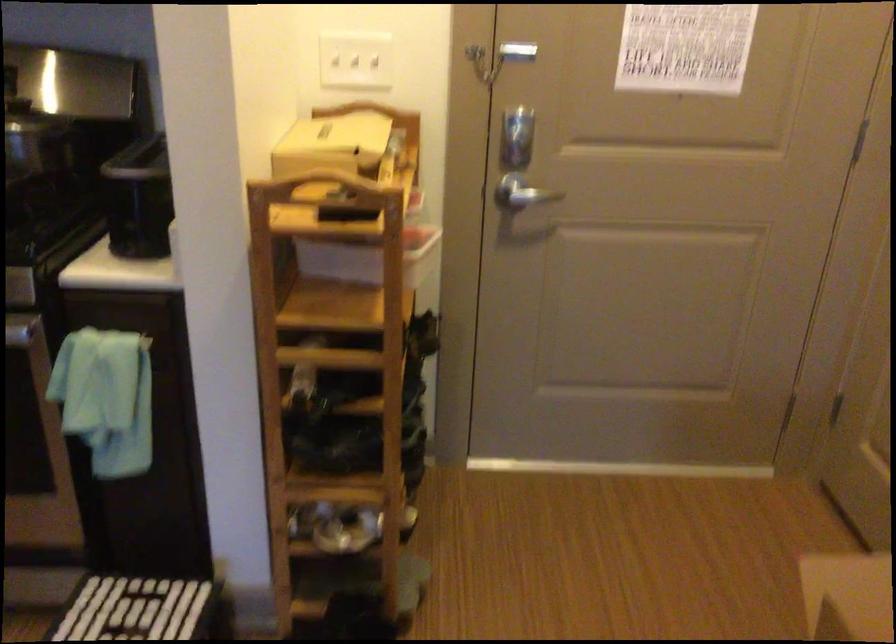
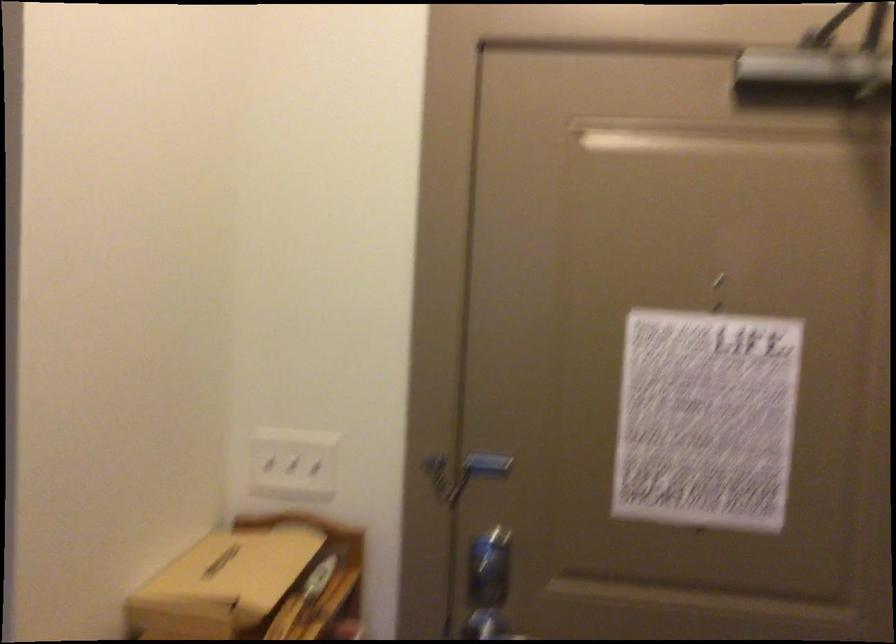
Question: The first image is from the beginning of the video and the second image is from the end. How did the camera likely rotate when shooting the video?

Choices:
 (A) Left
 (B) Right
 (C) Up
 (D) Down

Answer: (C)